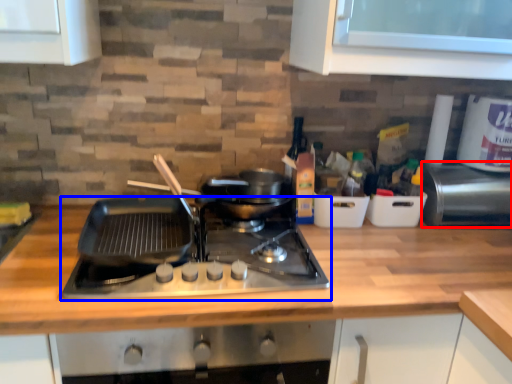
Question: Which point is closer to the camera, appliance (highlighted by a red box) or gas stove (highlighted by a blue box)?

Choices:
 (A) appliance
 (B) gas stove

Answer: (B)